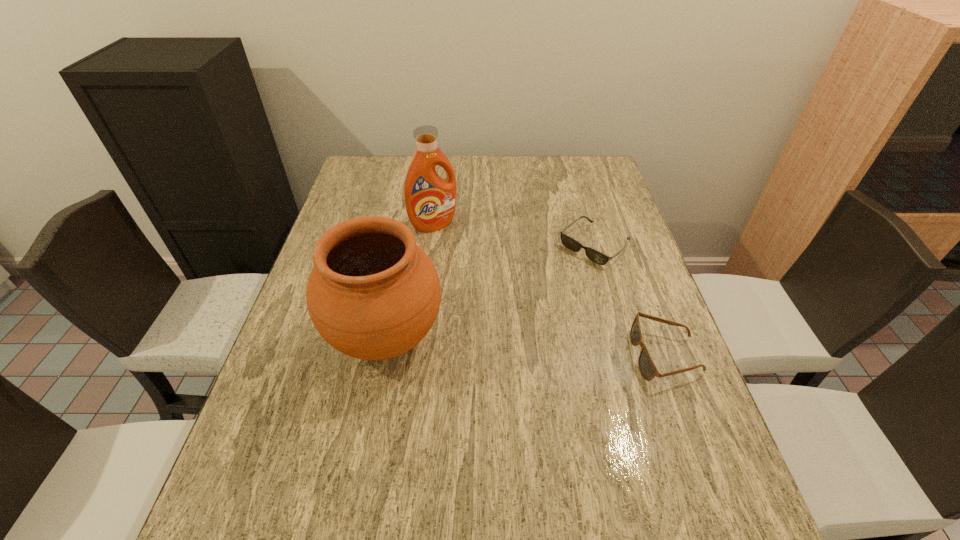
Locate an element on the screen. free spot on the desktop that is between the pottery and the taller sunglasses and is positioned on the front-facing side of the detergent is located at coordinates (533, 347).

In order to click on free space on the desktop that is between the pottery and the taller sunglasses and is positioned on the front-facing side of the farther sunglasses in this screenshot , I will do tap(482, 343).